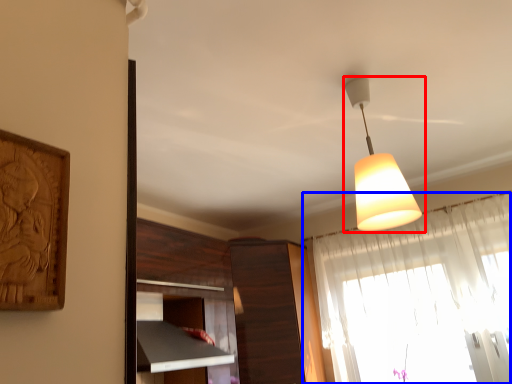
Question: Which object is closer to the camera taking this photo, lamp (highlighted by a red box) or curtain (highlighted by a blue box)?

Choices:
 (A) lamp
 (B) curtain

Answer: (A)